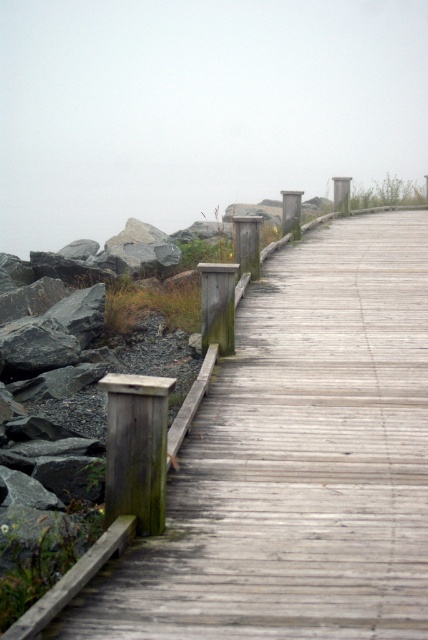
Does weathered wood boardwalk at left appear under foggy gray at upper center?

Indeed, weathered wood boardwalk at left is positioned under foggy gray at upper center.

Which is above, weathered wood boardwalk at left or foggy gray at upper center?

foggy gray at upper center is above.

What do you see at coordinates (297, 461) in the screenshot?
I see `weathered wood boardwalk at left` at bounding box center [297, 461].

Identify the location of weathered wood boardwalk at left. The image size is (428, 640). (297, 461).